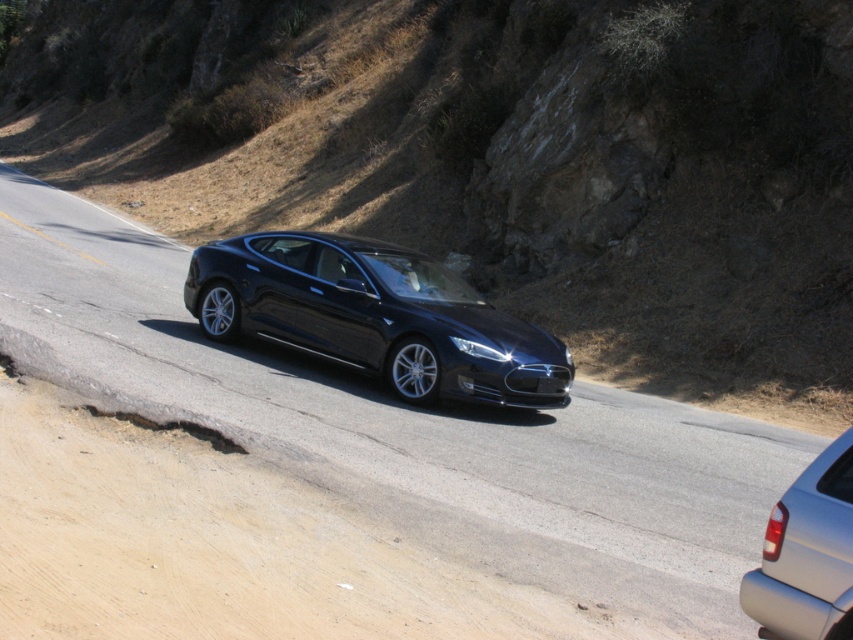
Does dried grass at upper center have a larger size compared to shiny black sedan at center?

Indeed, dried grass at upper center has a larger size compared to shiny black sedan at center.

Which is in front, point (347, 172) or point (527, 358)?

Point (527, 358)

Locate an element on the screen. The width and height of the screenshot is (853, 640). dried grass at upper center is located at coordinates (492, 154).

Is point (769, 625) less distant than point (466, 381)?

That is True.

From the picture: Can you confirm if satin silver sedan at lower right is positioned above black glossy license plate at center?

Incorrect, satin silver sedan at lower right is not positioned above black glossy license plate at center.

What do you see at coordinates (807, 554) in the screenshot? I see `satin silver sedan at lower right` at bounding box center [807, 554].

Where is `satin silver sedan at lower right`? The width and height of the screenshot is (853, 640). satin silver sedan at lower right is located at coordinates (807, 554).

Does point (321, 538) lie in front of point (463, 381)?

Yes, point (321, 538) is in front of point (463, 381).

Is glossy black car at center taller than black glossy license plate at center?

Indeed, glossy black car at center has a greater height compared to black glossy license plate at center.

Where is `glossy black car at center`? Image resolution: width=853 pixels, height=640 pixels. glossy black car at center is located at coordinates (332, 477).